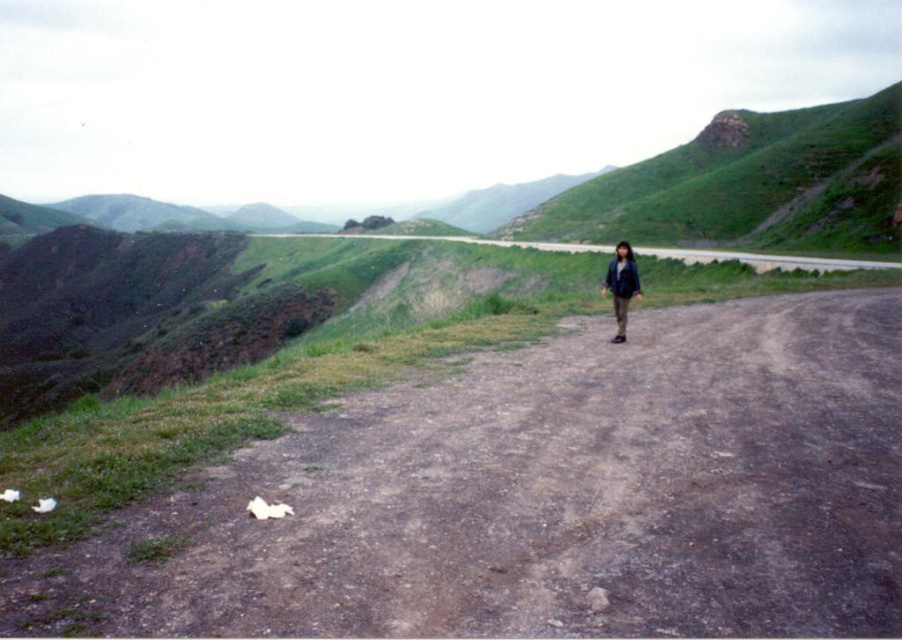
You are standing at the starting point of your journey and see the dull brown dirt track at center. According to the map, the track is located at coordinates point 0.778, 0.606. If you walk straight ahead along the dirt track, will you eventually reach the horizon line?

Yes, because the dull brown dirt track at center extends all the way to the horizon line, so walking straight along it will lead you there.